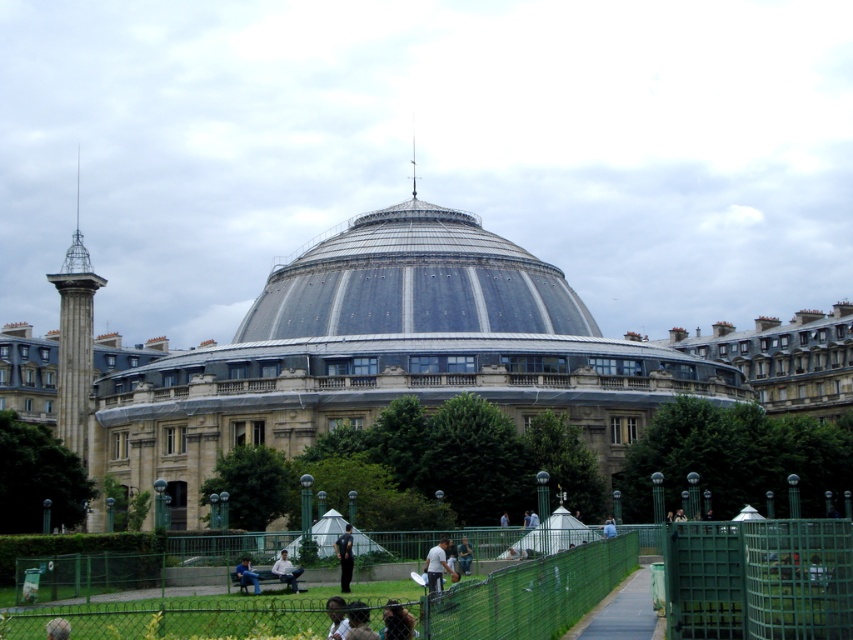
Who is positioned more to the left, dark brown hair at lower center or light brown leather jacket at center?

dark brown hair at lower center is more to the left.

Is dark brown hair at lower center below light brown leather jacket at center?

No.

Identify the location of dark brown hair at lower center. (358, 621).

This screenshot has width=853, height=640. I want to click on dark brown hair at lower center, so click(358, 621).

Who is taller, stone dome at center or light brown skin at lower center?

Standing taller between the two is stone dome at center.

Is stone dome at center to the right of light brown skin at lower center from the viewer's perspective?

Indeed, stone dome at center is positioned on the right side of light brown skin at lower center.

Which is behind, point (175, 365) or point (337, 602)?

The point (175, 365) is behind.

The height and width of the screenshot is (640, 853). Identify the location of stone dome at center. (401, 355).

Is stone dome at center to the right of light brown leather jacket at center from the viewer's perspective?

Incorrect, stone dome at center is not on the right side of light brown leather jacket at center.

Can you confirm if stone dome at center is shorter than light brown leather jacket at center?

In fact, stone dome at center may be taller than light brown leather jacket at center.

Describe the element at coordinates (401, 355) in the screenshot. I see `stone dome at center` at that location.

Locate an element on the screen. The width and height of the screenshot is (853, 640). stone dome at center is located at coordinates (401, 355).